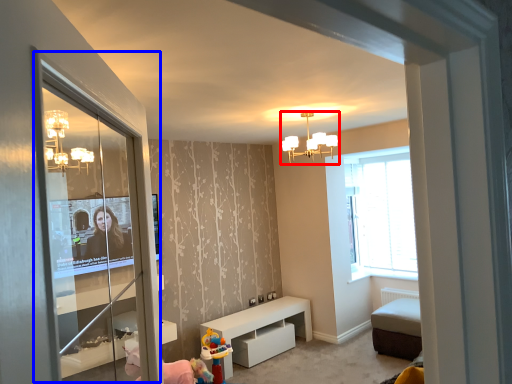
Question: Which point is further to the camera, light fixture (highlighted by a red box) or screen door (highlighted by a blue box)?

Choices:
 (A) light fixture
 (B) screen door

Answer: (A)